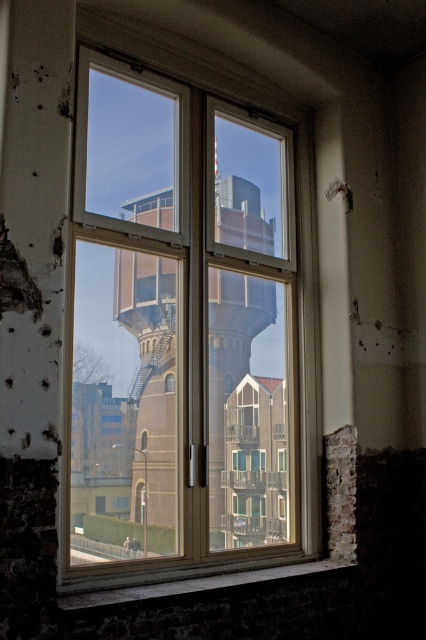
You are standing in front of the window and want to know which of the two points, point [201,308] or point [161,320], is closer to you. Which one is closer?

Point [161,320] is closer to you because it is less further to the camera than point [201,308].